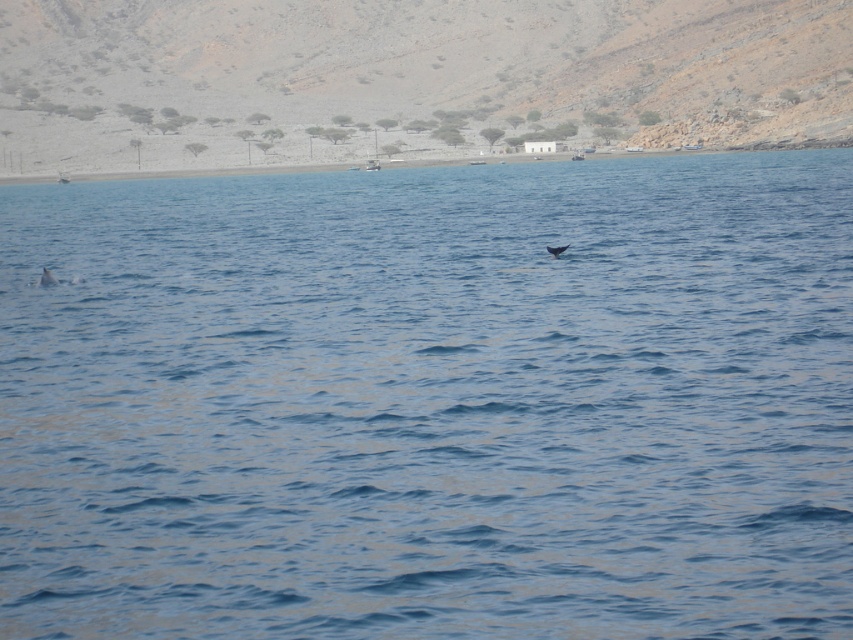
Question: Among these points, which one is nearest to the camera?

Choices:
 (A) tap(567, 243)
 (B) tap(45, 273)

Answer: (B)

Question: Which object appears closest to the camera in this image?

Choices:
 (A) light gray dolphin at left
 (B) gray matte whale at center

Answer: (A)

Question: Which of the following is the closest to the observer?

Choices:
 (A) (552, 250)
 (B) (44, 273)

Answer: (B)

Question: Is light gray dolphin at left thinner than gray matte whale at center?

Choices:
 (A) no
 (B) yes

Answer: (B)

Question: From the image, what is the correct spatial relationship of light gray dolphin at left in relation to gray matte whale at center?

Choices:
 (A) above
 (B) below

Answer: (B)

Question: From the image, what is the correct spatial relationship of light gray dolphin at left in relation to gray matte whale at center?

Choices:
 (A) left
 (B) right

Answer: (A)